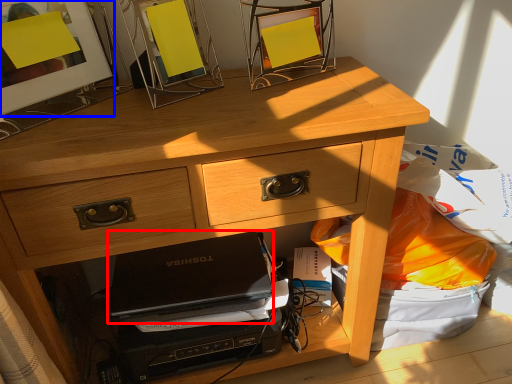
Question: Which object is closer to the camera taking this photo, laptop (highlighted by a red box) or picture frame (highlighted by a blue box)?

Choices:
 (A) laptop
 (B) picture frame

Answer: (B)